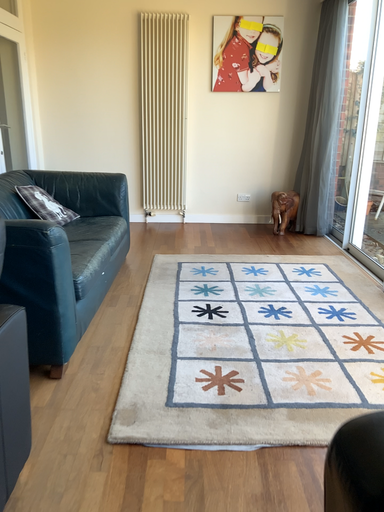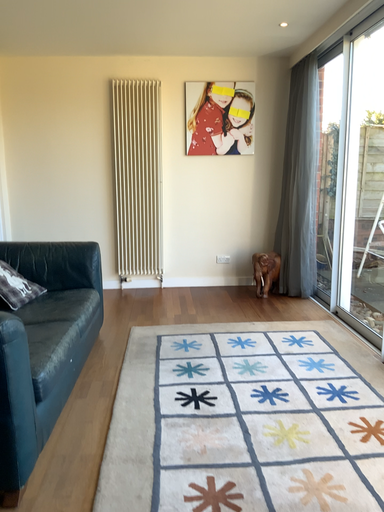
Question: How did the camera likely rotate when shooting the video?

Choices:
 (A) rotated upward
 (B) rotated downward

Answer: (A)